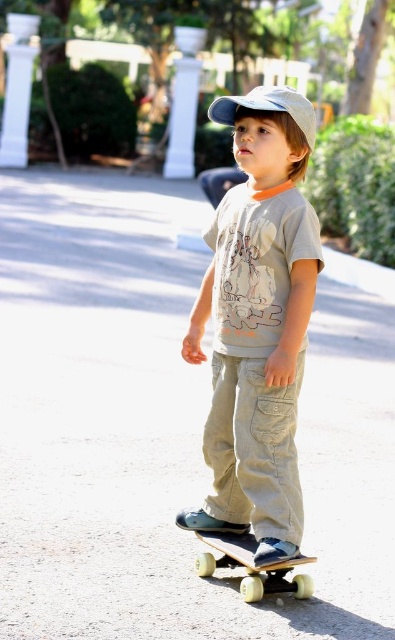
You are a photographer trying to capture the child and their skateboard. If you want to frame the light gray cotton shirt at center and the yellow wheels skateboard at center so that the shirt appears to the left of the skateboard in the photo, does the current arrangement allow this?

Yes, the current arrangement allows the light gray cotton shirt at center to appear to the left of the yellow wheels skateboard at center because the shirt is already positioned to the left of the skateboard.

You are a photographer trying to capture a closeup shot of the light gray cotton shirt at center and the yellow wheels skateboard at center. Your camera can focus on objects within a 20 inch range. Can you capture both subjects in focus without moving the camera?

The distance between the light gray cotton shirt at center and yellow wheels skateboard at center is 21.79 inches. Since the camera can only focus within a 20 inch range, you cannot capture both subjects in focus without moving the camera.

You are a photographer setting up a shot of the yellow wheels skateboard at center. The camera is placed at the position of the child. How far in feet should you move the camera backward to ensure the skateboard is in focus if the minimum focusing distance is 13 feet?

The yellow wheels skateboard at center is 13.05 feet away from the child. Since the minimum focusing distance is 13 feet, you need to move the camera backward by 0.05 feet to ensure the skateboard is in focus.